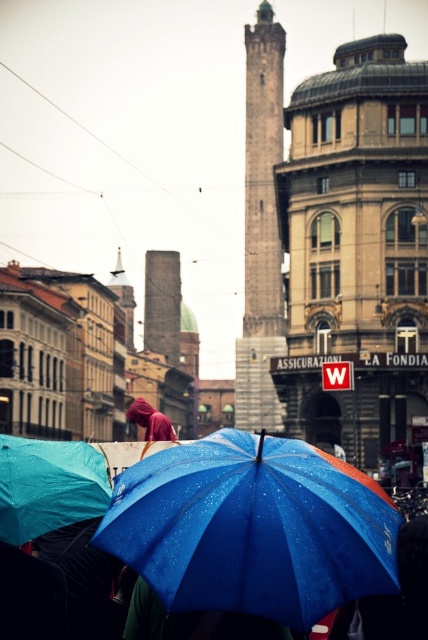
Which is in front, point (259, 337) or point (95, 481)?

Point (95, 481) is in front.

Describe the element at coordinates (261, 228) in the screenshot. I see `gray stone tower at center` at that location.

Find the location of `gray stone tower at center`. gray stone tower at center is located at coordinates (261, 228).

Locate an element on the screen. This screenshot has height=640, width=428. gray stone tower at center is located at coordinates (261, 228).

How far apart are gray stone tower at center and velvet maroon hoodie at center?

The distance of gray stone tower at center from velvet maroon hoodie at center is 23.13 meters.

Is point (252, 285) closer to camera compared to point (145, 408)?

No, it is not.

Locate an element on the screen. This screenshot has height=640, width=428. gray stone tower at center is located at coordinates (261, 228).

Is blue matte umbrella at lower center to the left of velvet maroon hoodie at center from the viewer's perspective?

No, blue matte umbrella at lower center is not to the left of velvet maroon hoodie at center.

Does blue matte umbrella at lower center have a greater height compared to velvet maroon hoodie at center?

No, blue matte umbrella at lower center is not taller than velvet maroon hoodie at center.

Does point (53, 512) lie in front of point (136, 417)?

Yes, point (53, 512) is closer to viewer.

What are the coordinates of `blue matte umbrella at lower center` in the screenshot? It's located at (48, 486).